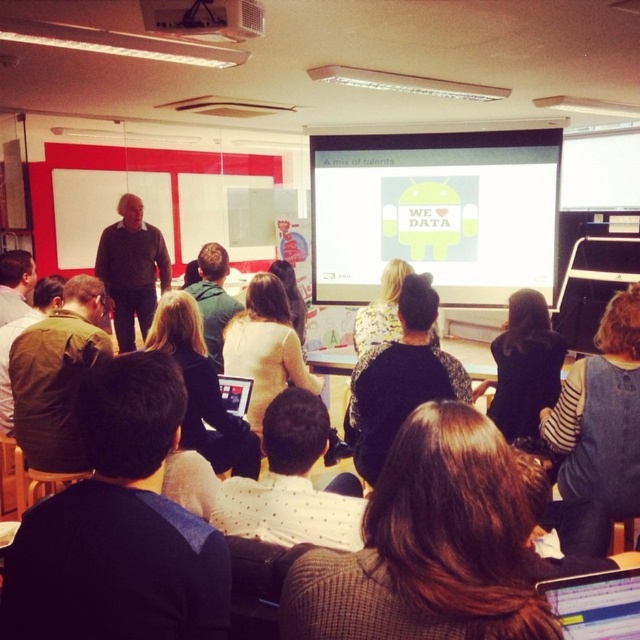
Question: Which object is positioned closest to the matte green sweater at upper left?

Choices:
 (A) floral-patterned sweater at center
 (B) floral-patterned blouse at center
 (C) dark blue fabric at center
 (D) dark brown sweater at center

Answer: (D)

Question: Which of the following is the farthest from the observer?

Choices:
 (A) striped fabric sweater at center
 (B) white fabric laptop at center

Answer: (B)

Question: Is dark blue fabric at center wider than matte green sweater at upper left?

Choices:
 (A) yes
 (B) no

Answer: (A)

Question: Can you confirm if brown knitted sweater at center is positioned below floral-patterned sweater at center?

Choices:
 (A) yes
 (B) no

Answer: (A)

Question: Does striped fabric sweater at center have a lesser width compared to matte green jacket at left?

Choices:
 (A) no
 (B) yes

Answer: (B)

Question: Which point is closer to the camera taking this photo?

Choices:
 (A) (541, 316)
 (B) (296, 467)

Answer: (B)